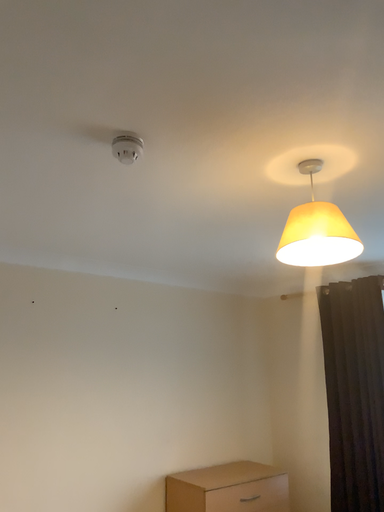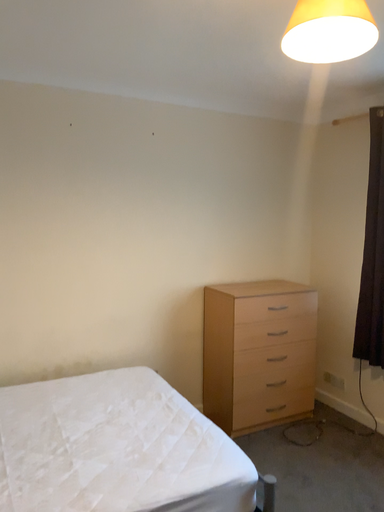
Question: How did the camera likely rotate when shooting the video?

Choices:
 (A) rotated upward
 (B) rotated downward

Answer: (B)